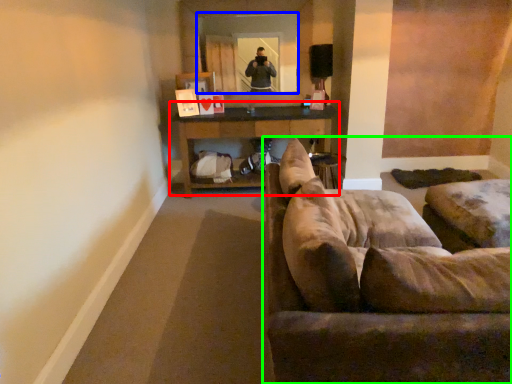
Question: Which object is positioned farthest from table (highlighted by a red box)? Select from mirror (highlighted by a blue box) and studio couch (highlighted by a green box).

Choices:
 (A) mirror
 (B) studio couch

Answer: (B)